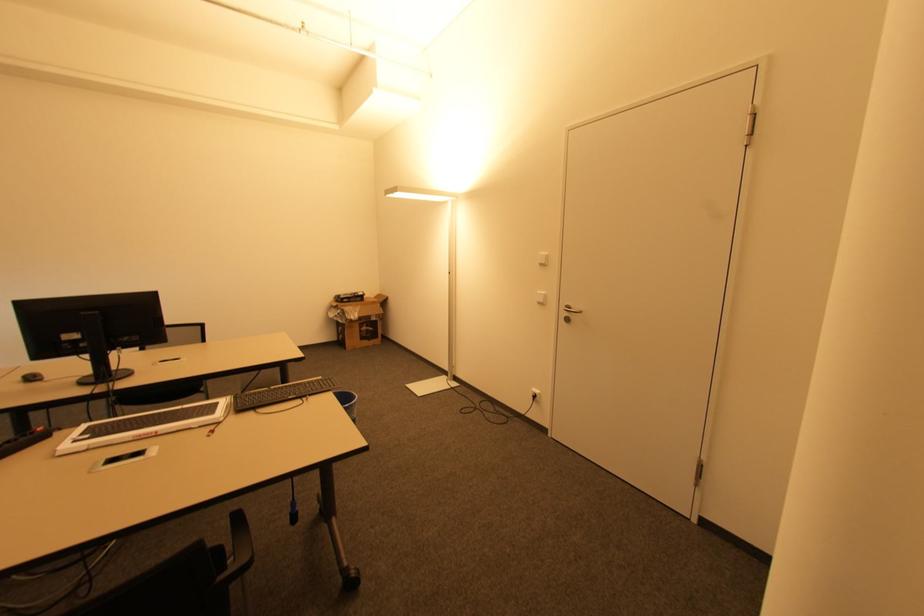
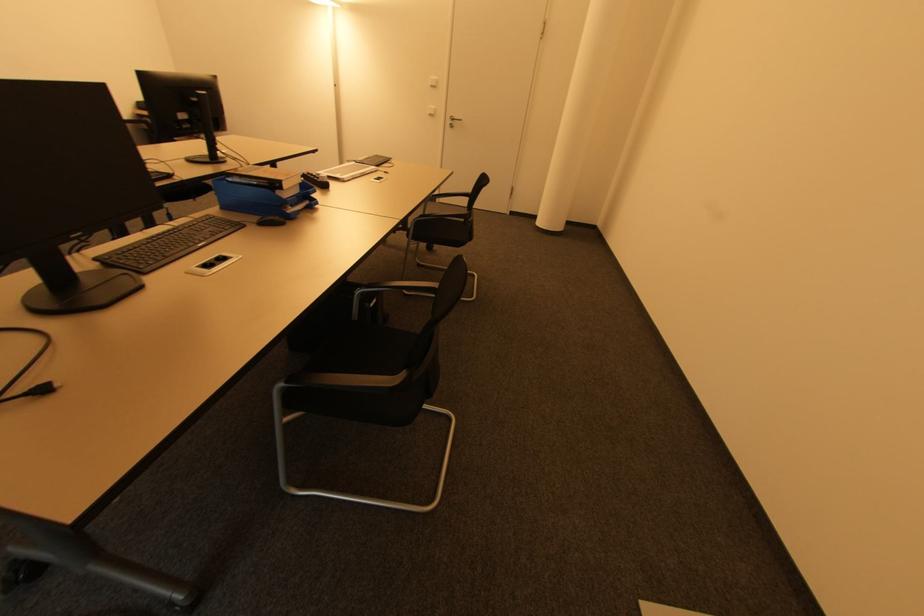
In the second image, find the point that corresponds to point 542,265 in the first image.

(434, 87)